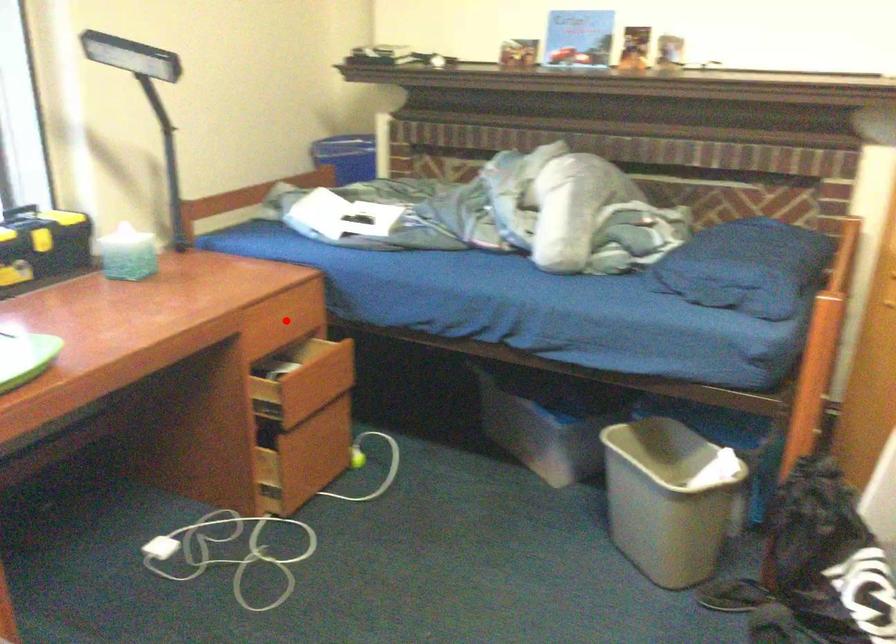
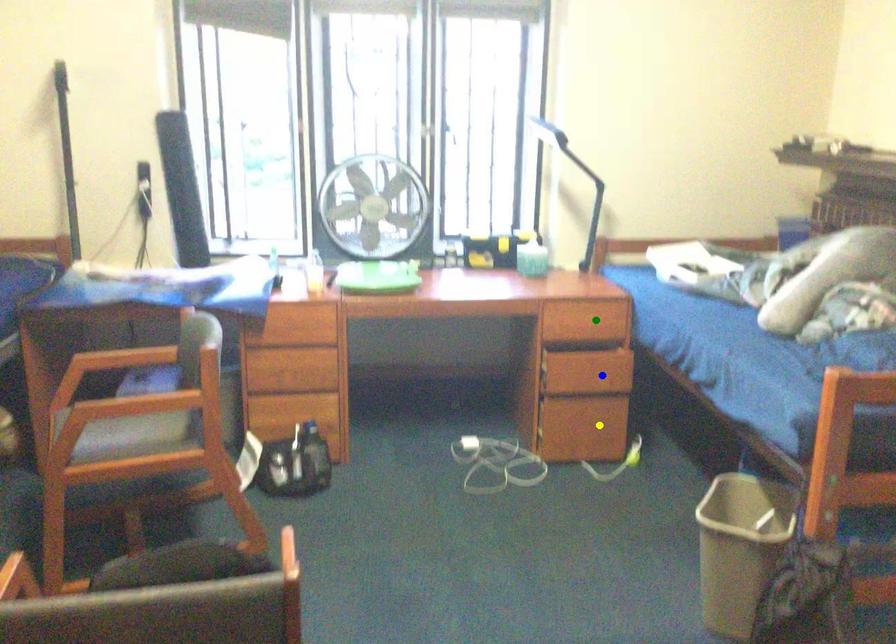
Question: I am providing you with two images of the same scene from different viewpoints. A red point is marked on the first image. You are given multiple points on the second image. Which spot in image 2 lines up with the point in image 1?

Choices:
 (A) yellow point
 (B) green point
 (C) blue point

Answer: (B)